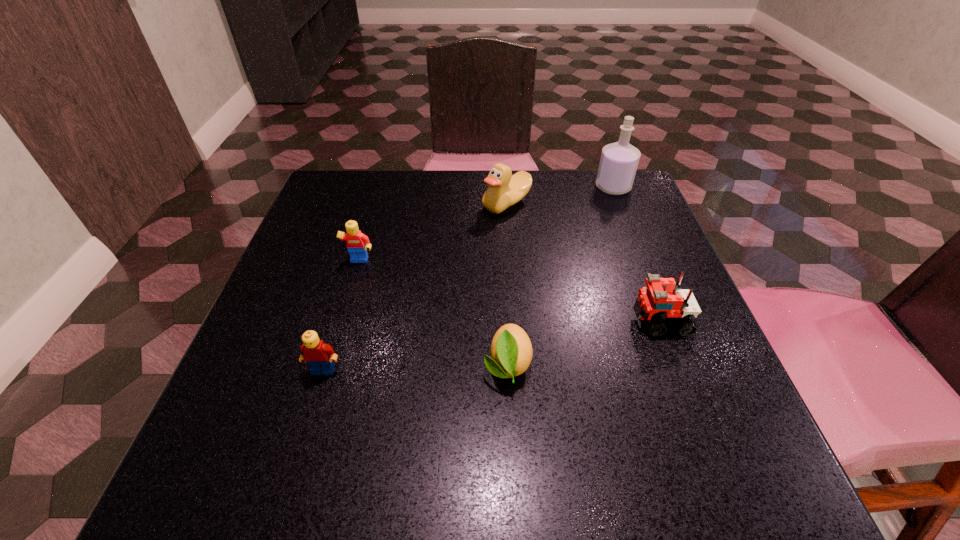
I want to click on vacant space located 0.220m at the beak of the duck, so click(x=393, y=204).

Where is `vacant space located on the front-facing side of the second farthest Lego`? This screenshot has width=960, height=540. vacant space located on the front-facing side of the second farthest Lego is located at coordinates (601, 320).

Find the location of a particular element. This screenshot has height=540, width=960. free space located 0.110m on the front-facing side of the second farthest Lego is located at coordinates (574, 320).

Find the location of `vacant space situated 0.190m on the front-facing side of the second farthest Lego`. vacant space situated 0.190m on the front-facing side of the second farthest Lego is located at coordinates (531, 320).

Identify the location of vacant space located 0.360m on the face of the farthest Lego. (310, 432).

The width and height of the screenshot is (960, 540). I want to click on free space located 0.160m on the front-facing side of the nearest Lego, so click(292, 474).

Locate an element on the screen. The height and width of the screenshot is (540, 960). vacant space located 0.100m with leaves positioned above the shortest object is located at coordinates [513, 457].

Locate an element on the screen. This screenshot has width=960, height=540. perfume positioned at the far edge is located at coordinates (618, 164).

I want to click on duck located at the far edge, so [504, 189].

Find the location of a particular element. The height and width of the screenshot is (540, 960). perfume that is positioned at the right edge is located at coordinates (618, 164).